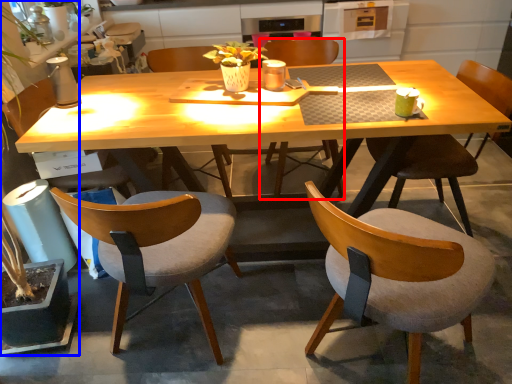
Question: Which point is further to the camera, chair (highlighted by a red box) or houseplant (highlighted by a blue box)?

Choices:
 (A) chair
 (B) houseplant

Answer: (A)